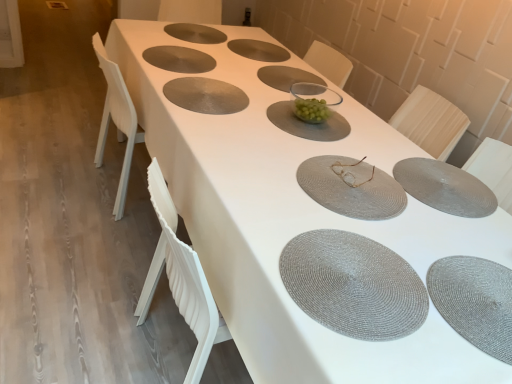
Where is `vacant region under gray woven placemat at center, the 2th tableware in the bottom-to-top sequence (from a real-world perspective)`? vacant region under gray woven placemat at center, the 2th tableware in the bottom-to-top sequence (from a real-world perspective) is located at coordinates (437, 181).